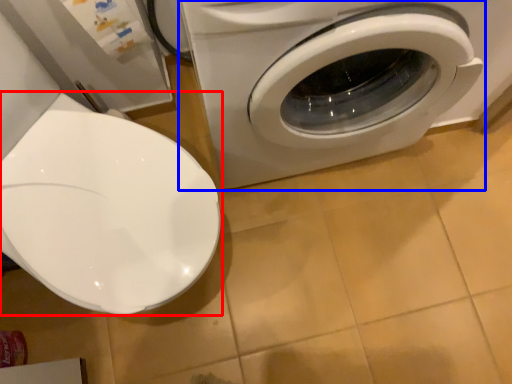
Question: Which point is further to the camera, toilet (highlighted by a red box) or washing machine (highlighted by a blue box)?

Choices:
 (A) toilet
 (B) washing machine

Answer: (B)